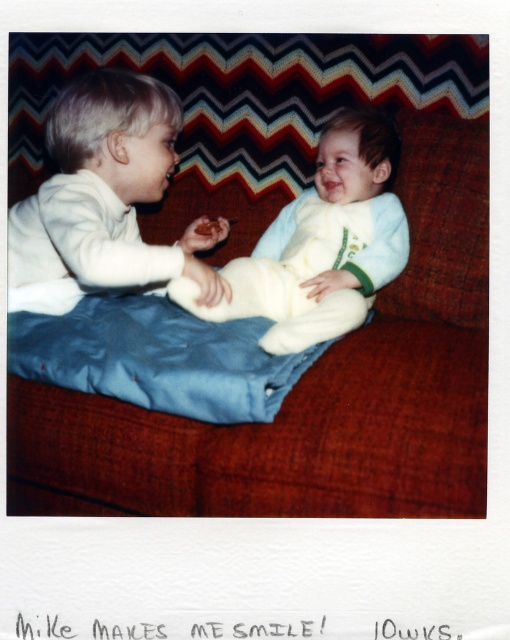
Question: Is red fabric couch at center above white fluffy pillow at center?

Choices:
 (A) no
 (B) yes

Answer: (A)

Question: Can you confirm if light blue fleece onesie at center is positioned above white fluffy pillow at center?

Choices:
 (A) no
 (B) yes

Answer: (A)

Question: Which object is positioned farthest from the light blue fleece onesie at center?

Choices:
 (A) white fluffy pillow at center
 (B) red fabric couch at center
 (C) matte white shirt at left

Answer: (C)

Question: Which point is closer to the camera?

Choices:
 (A) matte white shirt at left
 (B) white fluffy pillow at center

Answer: (A)

Question: Is matte white shirt at left closer to camera compared to white fluffy pillow at center?

Choices:
 (A) no
 (B) yes

Answer: (B)

Question: Which of the following is the farthest from the observer?

Choices:
 (A) (470, 305)
 (B) (142, 424)
 (C) (128, 220)

Answer: (C)